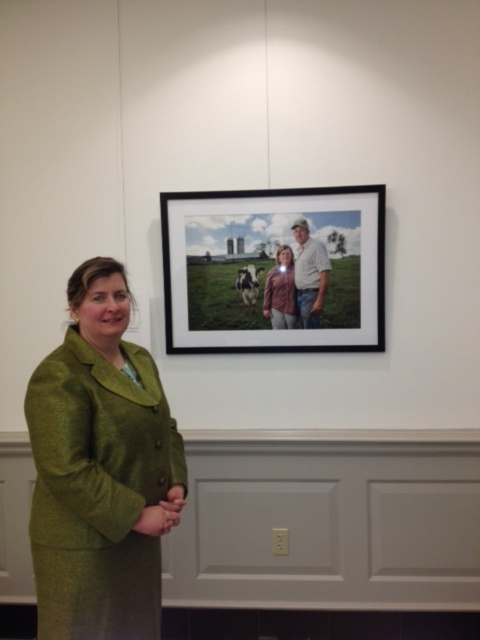
Question: Estimate the real-world distances between objects in this image. Which object is closer to the white cotton shirt at upper center?

Choices:
 (A) green woolen suit at left
 (B) matte pink shirt at center
 (C) matte black frame at upper center

Answer: (B)

Question: Which object is the closest to the matte pink shirt at center?

Choices:
 (A) matte black frame at upper center
 (B) green woolen suit at left

Answer: (A)

Question: Can you confirm if green woolen suit at left is bigger than matte pink shirt at center?

Choices:
 (A) yes
 (B) no

Answer: (A)

Question: Which point appears closest to the camera in this image?

Choices:
 (A) (319, 241)
 (B) (278, 236)
 (C) (122, 621)

Answer: (C)

Question: Considering the relative positions of green woolen suit at left and white cotton shirt at upper center in the image provided, where is green woolen suit at left located with respect to white cotton shirt at upper center?

Choices:
 (A) left
 (B) right

Answer: (A)

Question: Does white cotton shirt at upper center have a greater width compared to matte pink shirt at center?

Choices:
 (A) no
 (B) yes

Answer: (B)